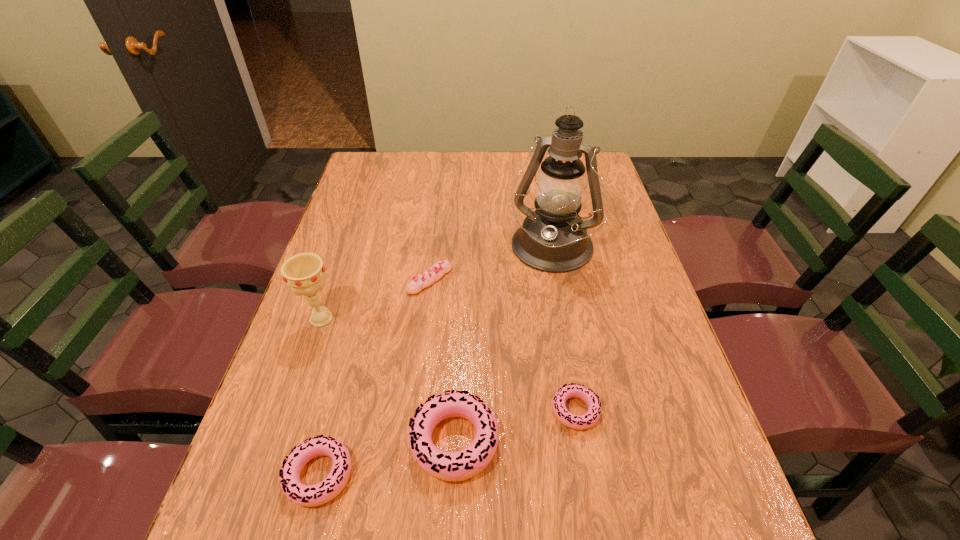
Find the location of a particular element. The image size is (960, 540). free space at the right edge of the desktop is located at coordinates (608, 208).

Where is `vacant space at the far left corner`? This screenshot has width=960, height=540. vacant space at the far left corner is located at coordinates (393, 153).

In the image, there is a desktop. At what (x,y) coordinates should I click in order to perform the action: click on vacant space at the far right corner. Please return your answer as a coordinate pair (x, y). This screenshot has width=960, height=540. Looking at the image, I should click on (587, 175).

This screenshot has width=960, height=540. I want to click on blank region between the shortest doughnut and the oil lamp, so click(563, 330).

You are a GUI agent. You are given a task and a screenshot of the screen. Output one action in this format:
    pyautogui.click(x=<x>, y=<y>)
    Task: Click on the vacant area that lies between the fourth shortest object and the shortest doughnut
    The image size is (960, 540).
    Given the screenshot: What is the action you would take?
    pyautogui.click(x=515, y=426)

This screenshot has height=540, width=960. In order to click on free space between the oil lamp and the fourth shortest object in this screenshot , I will do tap(502, 346).

Image resolution: width=960 pixels, height=540 pixels. I want to click on empty space that is in between the third tallest object and the eclair, so click(442, 360).

Identify the location of unoccupied area between the tallest object and the eclair. (491, 265).

This screenshot has height=540, width=960. In order to click on blank region between the leftmost doughnut and the third farthest object in this screenshot , I will do `click(321, 397)`.

In order to click on free space between the oil lamp and the shortest doughnut in this screenshot , I will do 563,330.